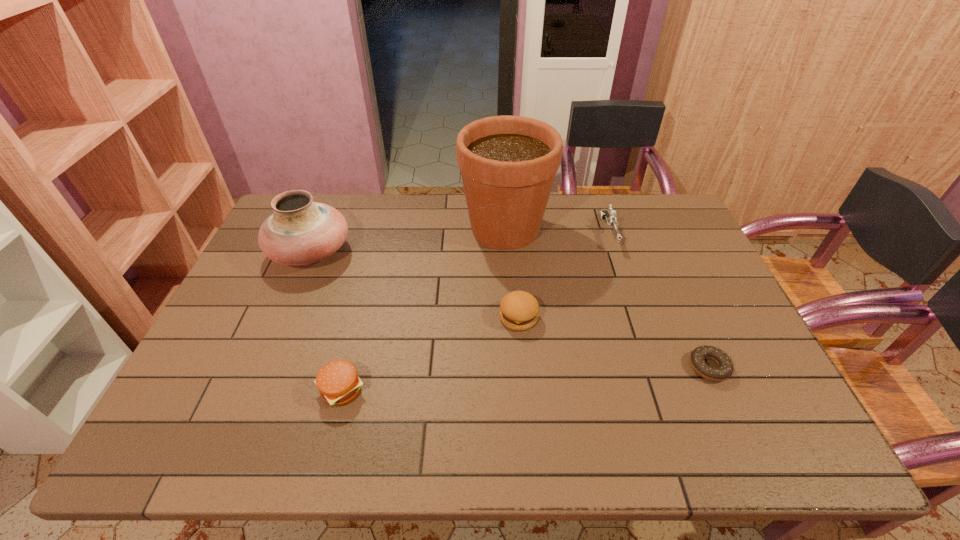
The image size is (960, 540). In order to click on unoccupied area between the shortest object and the right hamburger in this screenshot , I will do `click(613, 342)`.

Identify the location of free space between the second object from right to left and the left hamburger. (475, 312).

This screenshot has width=960, height=540. What are the coordinates of `free spot between the shortest object and the left hamburger` in the screenshot? It's located at (525, 379).

You are a GUI agent. You are given a task and a screenshot of the screen. Output one action in this format:
    pyautogui.click(x=<x>, y=<y>)
    Task: Click on the vacant area that lies between the tallest object and the farther hamburger
    
    Given the screenshot: What is the action you would take?
    pyautogui.click(x=512, y=273)

This screenshot has width=960, height=540. I want to click on free space between the tallest object and the rightmost object, so click(x=607, y=298).

The image size is (960, 540). I want to click on free space between the flowerpot and the pottery, so click(x=408, y=240).

Locate an element on the screen. The height and width of the screenshot is (540, 960). vacant space that is in between the right hamburger and the pottery is located at coordinates (415, 285).

The image size is (960, 540). I want to click on free spot between the fifth object from left to right and the flowerpot, so click(557, 231).

The width and height of the screenshot is (960, 540). Find the location of `object that is the fourth closest one to the tallest object`. object that is the fourth closest one to the tallest object is located at coordinates (724, 370).

Identify which object is located as the fifth nearest to the tallest object. Please provide its 2D coordinates. Your answer should be formatted as a tuple, i.e. [(x, y)], where the tuple contains the x and y coordinates of a point satisfying the conditions above.

[(338, 383)]